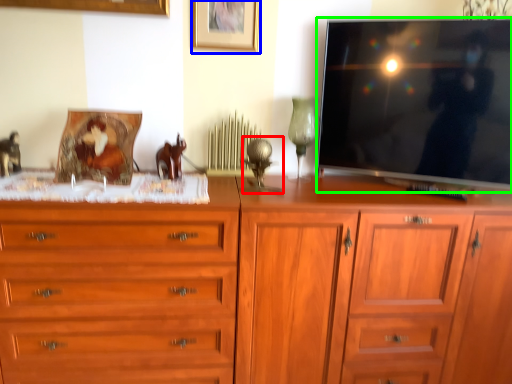
Question: Considering the real-world distances, which object is farthest from table lamp (highlighted by a red box)? picture frame (highlighted by a blue box) or television (highlighted by a green box)?

Choices:
 (A) picture frame
 (B) television

Answer: (B)